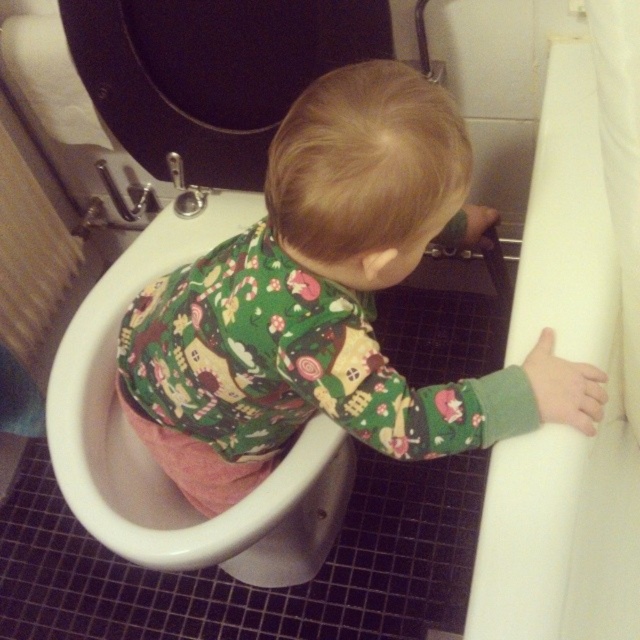
Question: Is green cotton pajamas at center thinner than white glossy toilet bowl at center?

Choices:
 (A) yes
 (B) no

Answer: (B)

Question: Is white glossy toilet bowl at center closer to camera compared to black glossy toilet lid at upper center?

Choices:
 (A) no
 (B) yes

Answer: (B)

Question: Observing the image, what is the correct spatial positioning of white glossy toilet bowl at center in reference to black glossy toilet lid at upper center?

Choices:
 (A) above
 (B) below

Answer: (B)

Question: Which of these objects is positioned closest to the green cotton pajamas at center?

Choices:
 (A) white glossy toilet bowl at center
 (B) black glossy toilet lid at upper center
 (C) white smooth bathtub at right

Answer: (A)

Question: Based on their relative distances, which object is nearer to the white glossy toilet bowl at center?

Choices:
 (A) black glossy toilet lid at upper center
 (B) green cotton pajamas at center
 (C) white smooth bathtub at right

Answer: (B)

Question: Which of these objects is positioned closest to the white smooth bathtub at right?

Choices:
 (A) white glossy toilet bowl at center
 (B) green cotton pajamas at center
 (C) black glossy toilet lid at upper center

Answer: (B)